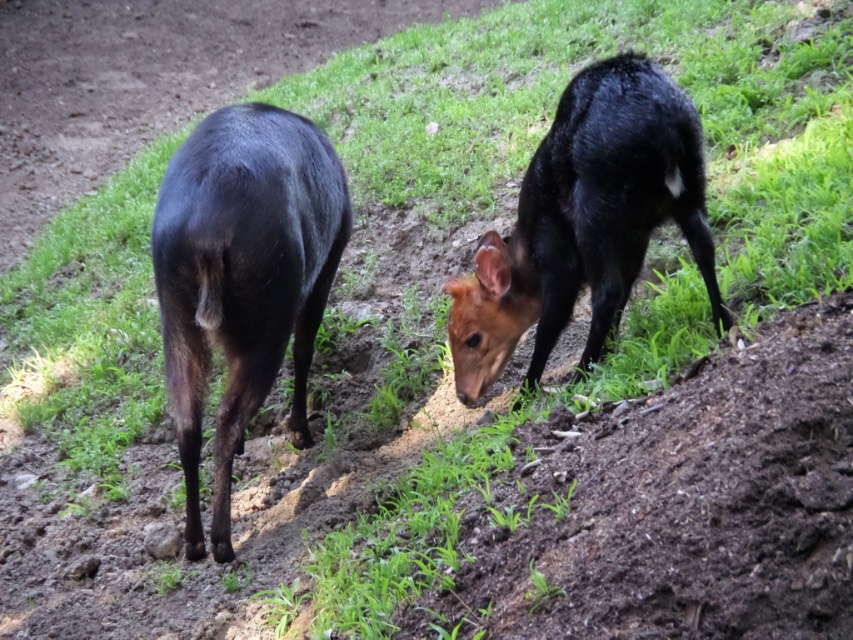
Does shiny black deer at left have a greater height compared to shiny black deer at center?

Yes.

Is shiny black deer at left bigger than shiny black deer at center?

Yes, shiny black deer at left is bigger than shiny black deer at center.

Who is more distant from viewer, (183, 328) or (492, 294)?

Positioned behind is point (492, 294).

At what (x,y) coordinates should I click in order to perform the action: click on shiny black deer at left. Please return your answer as a coordinate pair (x, y). The image size is (853, 640). Looking at the image, I should click on (242, 280).